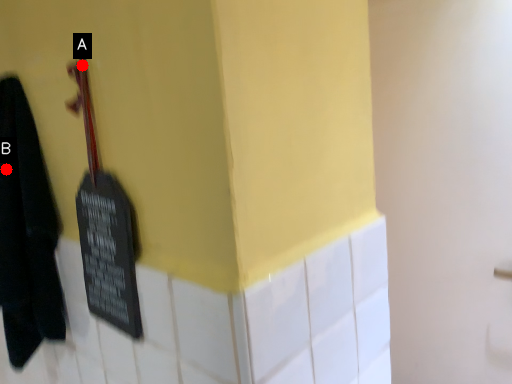
Question: Two points are circled on the image, labeled by A and B beside each circle. Which point is closer to the camera?

Choices:
 (A) A is closer
 (B) B is closer

Answer: (A)